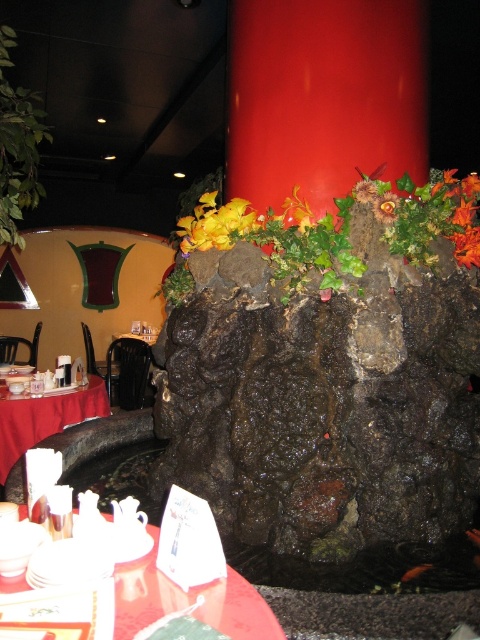
Does matte red table at lower left appear over red satin tablecloth at lower left?

Yes, matte red table at lower left is above red satin tablecloth at lower left.

Find the location of a particular element. Image resolution: width=480 pixels, height=640 pixels. matte red table at lower left is located at coordinates (189, 602).

This screenshot has height=640, width=480. I want to click on matte red table at lower left, so click(189, 602).

Who is higher up, dark rock at center or yellow matte flower at upper center?

yellow matte flower at upper center

Which of these two, dark rock at center or yellow matte flower at upper center, stands shorter?

Standing shorter between the two is yellow matte flower at upper center.

Which is in front, point (384, 419) or point (374, 189)?

Positioned in front is point (384, 419).

The height and width of the screenshot is (640, 480). Identify the location of dark rock at center. (323, 412).

Which is below, matte red table at lower left or yellow matte flower at upper center?

Positioned lower is matte red table at lower left.

Is matte red table at lower left closer to camera compared to yellow matte flower at upper center?

That is True.

Is point (236, 612) positioned in front of point (369, 189)?

Yes, point (236, 612) is closer to viewer.

At what (x,y) coordinates should I click in order to perform the action: click on matte red table at lower left. Please return your answer as a coordinate pair (x, y). Looking at the image, I should click on (189, 602).